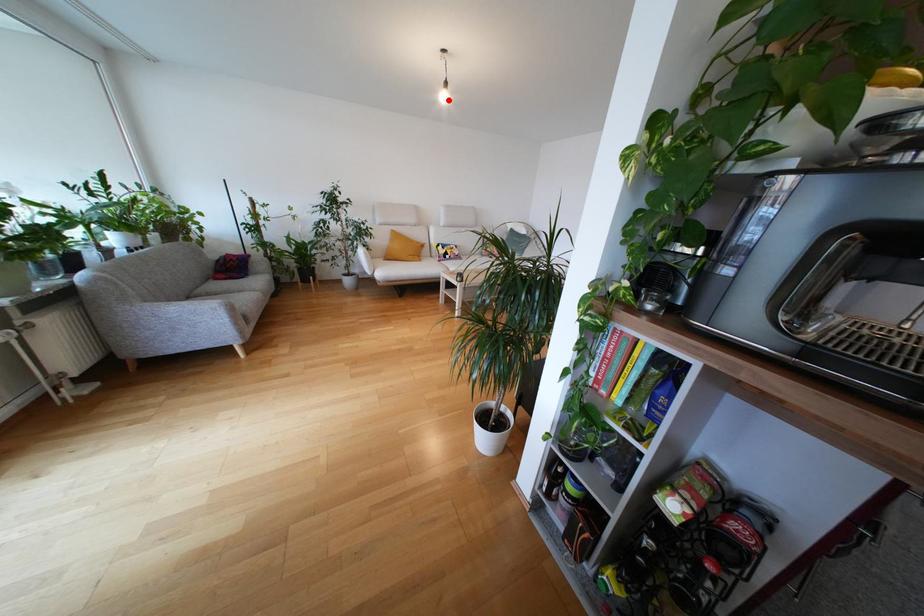
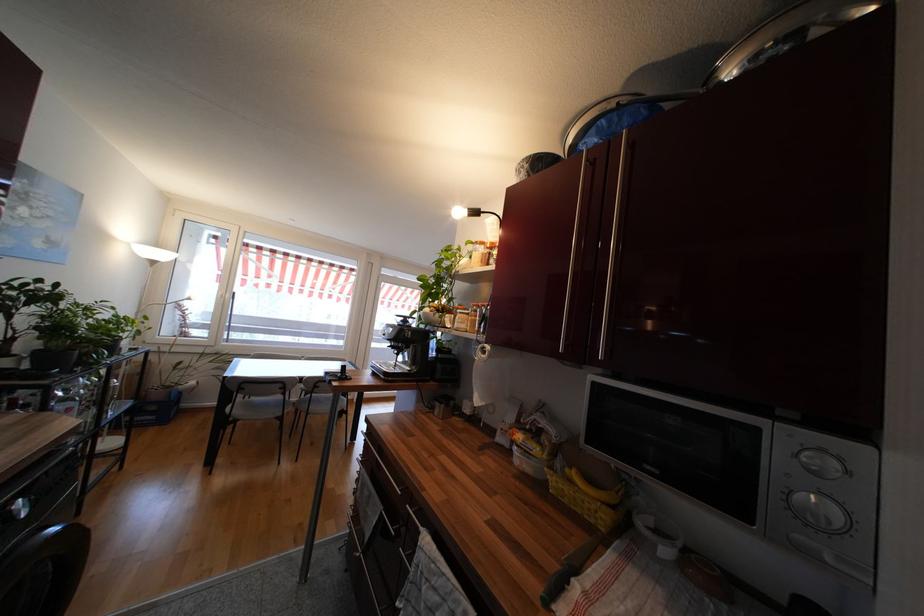
Question: I am providing you with two images of the same scene from different viewpoints. A red point is marked on the first image. At the location where the point appears in image 1, is it still visible in image 2?

Choices:
 (A) Yes
 (B) No

Answer: (B)